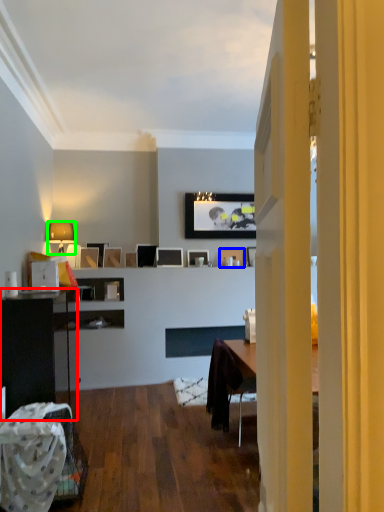
Question: Estimate the real-world distances between objects in this image. Which object is farther from cabinetry (highlighted by a red box), picture frame (highlighted by a blue box) or lamp (highlighted by a green box)?

Choices:
 (A) picture frame
 (B) lamp

Answer: (A)